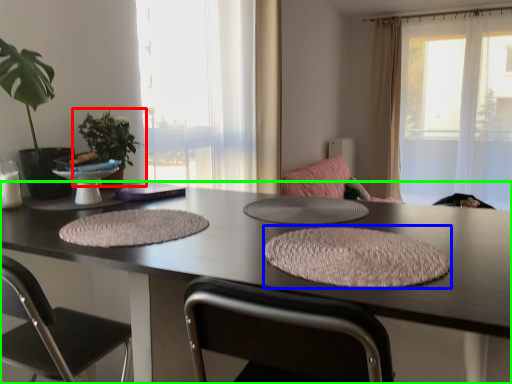
Question: Estimate the real-world distances between objects in this image. Which object is farther from houseplant (highlighted by a red box), yoga mat (highlighted by a blue box) or table (highlighted by a green box)?

Choices:
 (A) yoga mat
 (B) table

Answer: (A)